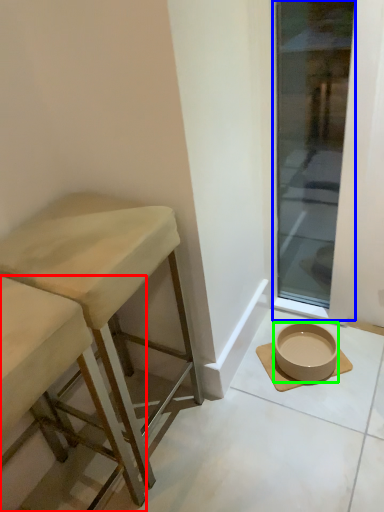
Question: Estimate the real-world distances between objects in this image. Which object is farther from stool (highlighted by a red box), window (highlighted by a blue box) or bowl (highlighted by a green box)?

Choices:
 (A) window
 (B) bowl

Answer: (A)